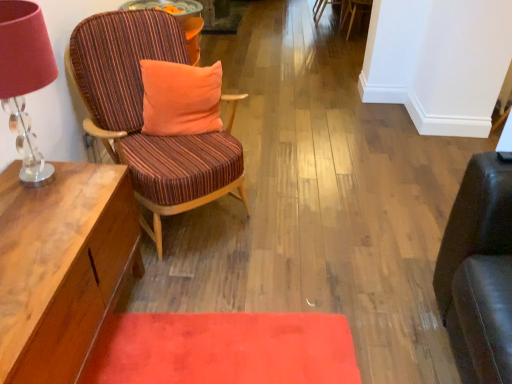
Where is `free space to the back side of velvety red mat at lower center`? free space to the back side of velvety red mat at lower center is located at coordinates (247, 267).